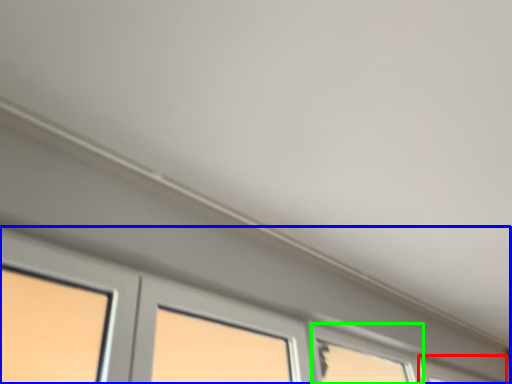
Question: Which object is the farthest from window (highlighted by a red box)? Choose among these: window (highlighted by a blue box) or window (highlighted by a green box).

Choices:
 (A) window
 (B) window

Answer: (B)